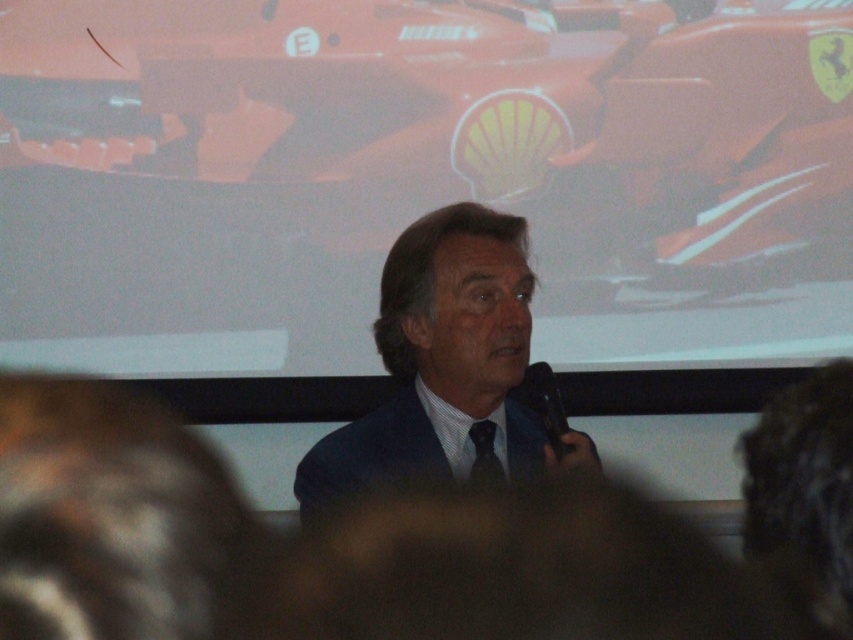
Question: Which object is the closest to the black satin tie at center?

Choices:
 (A) dark curly hair at lower right
 (B) navy blue suit at center
 (C) shiny orange car at upper center
 (D) black plastic microphone at center

Answer: (D)

Question: Is black plastic microphone at center closer to the viewer compared to black satin tie at center?

Choices:
 (A) yes
 (B) no

Answer: (B)

Question: Estimate the real-world distances between objects in this image. Which object is farther from the navy blue suit at center?

Choices:
 (A) black satin tie at center
 (B) dark curly hair at lower right
 (C) shiny orange car at upper center
 (D) dark blue suit at center

Answer: (C)

Question: Estimate the real-world distances between objects in this image. Which object is farther from the shiny orange car at upper center?

Choices:
 (A) dark curly hair at lower right
 (B) black satin tie at center
 (C) black plastic microphone at center
 (D) navy blue suit at center

Answer: (A)

Question: Is navy blue suit at center further to the viewer compared to black plastic microphone at center?

Choices:
 (A) no
 (B) yes

Answer: (A)

Question: Does shiny orange car at upper center have a larger size compared to black satin tie at center?

Choices:
 (A) no
 (B) yes

Answer: (B)